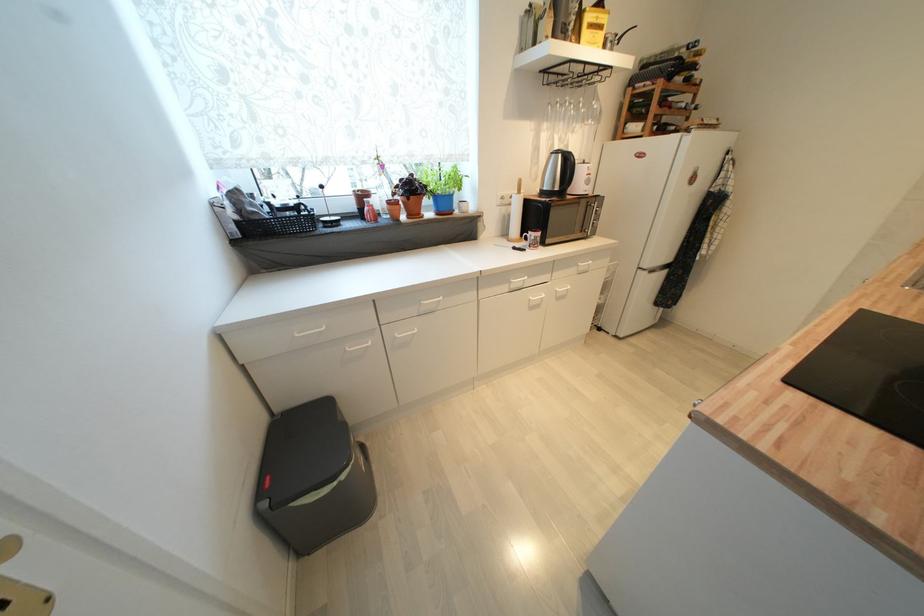
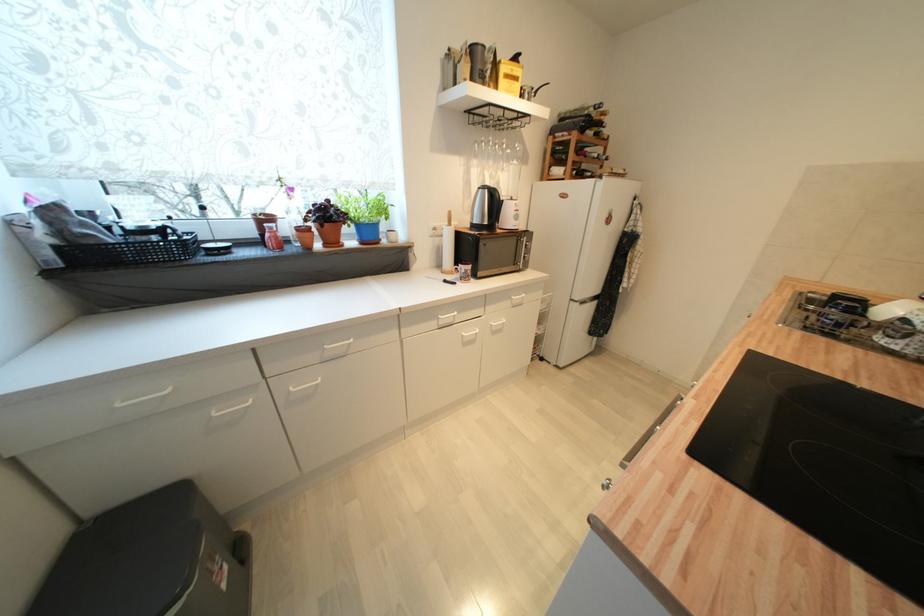
Question: I am providing you with two images of the same scene from different viewpoints. Which of the following objects are not visible in image2?

Choices:
 (A) terracotta plant pot
 (B) wine bottle
 (C) trash can lid
 (D) none of these

Answer: (D)